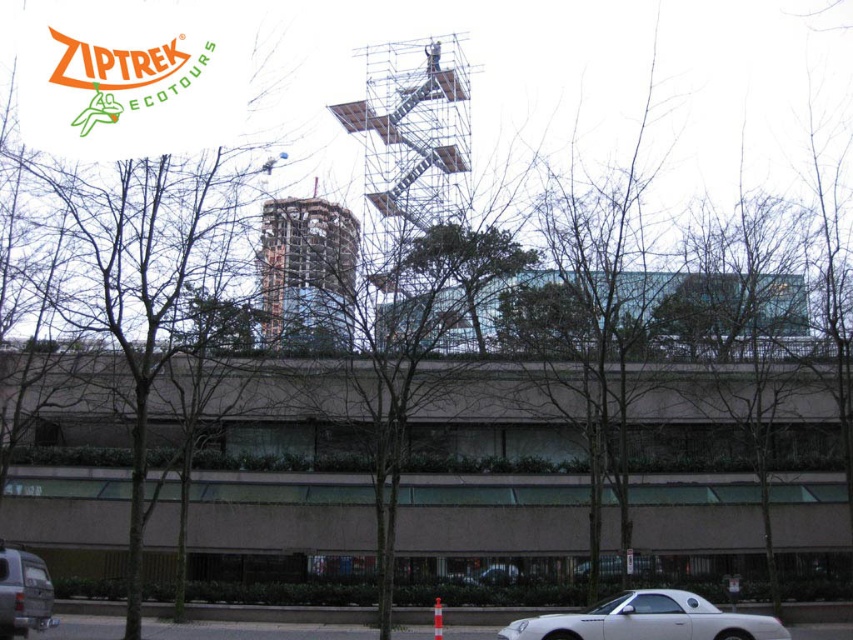
You are a photographer planning to capture the urban landscape with both the bare branches at center and the glassy steel tower at center in the frame. Which object occupies more horizontal space in the image?

The bare branches at center occupy more horizontal space than the glassy steel tower at center because the bare branches at center has a greater width according to the description.

You are a delivery driver who needs to park your white matte convertible at lower right as close as possible to the glassy steel tower at center without blocking the construction zone. According to the scene description, what is the minimum safe distance you must maintain between your vehicle and the tower?

The glassy steel tower at center is 60.38 feet from the white matte convertible at lower right. Therefore, the minimum safe distance you must maintain is 60.38 feet to avoid blocking the construction zone.

You are a construction worker who needs to move a heavy beam from the silver metallic scaffolding at center to the glassy steel tower at center. The beam is 15 feet long. Can you safely transport it horizontally between the two structures without bending or breaking it?

The silver metallic scaffolding at center and glassy steel tower at center are 17.11 feet apart. Since the beam is 15 feet long, it can be safely transported horizontally between them as the distance is greater than the beam length, allowing for a stable transfer without bending or breaking.